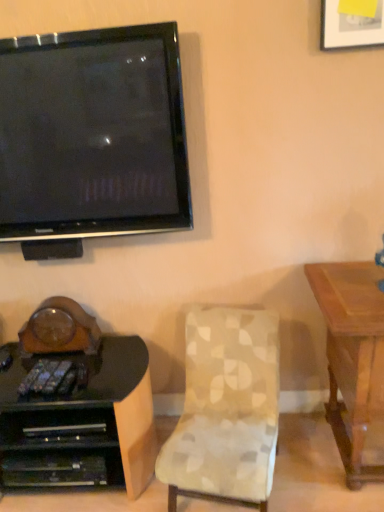
At what (x,y) coordinates should I click in order to perform the action: click on empty space that is to the right of patterned fabric chair at center. Please return your answer as a coordinate pair (x, y). Image resolution: width=384 pixels, height=512 pixels. Looking at the image, I should click on (311, 468).